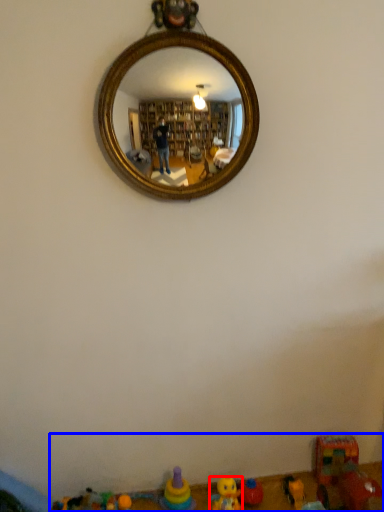
Question: Which point is closer to the camera, toy (highlighted by a red box) or toy (highlighted by a blue box)?

Choices:
 (A) toy
 (B) toy

Answer: (B)